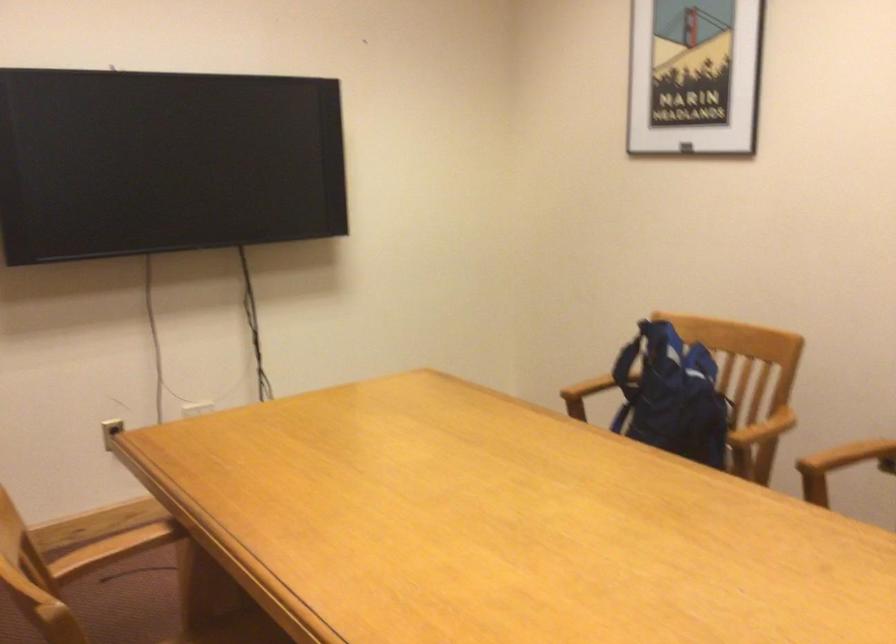
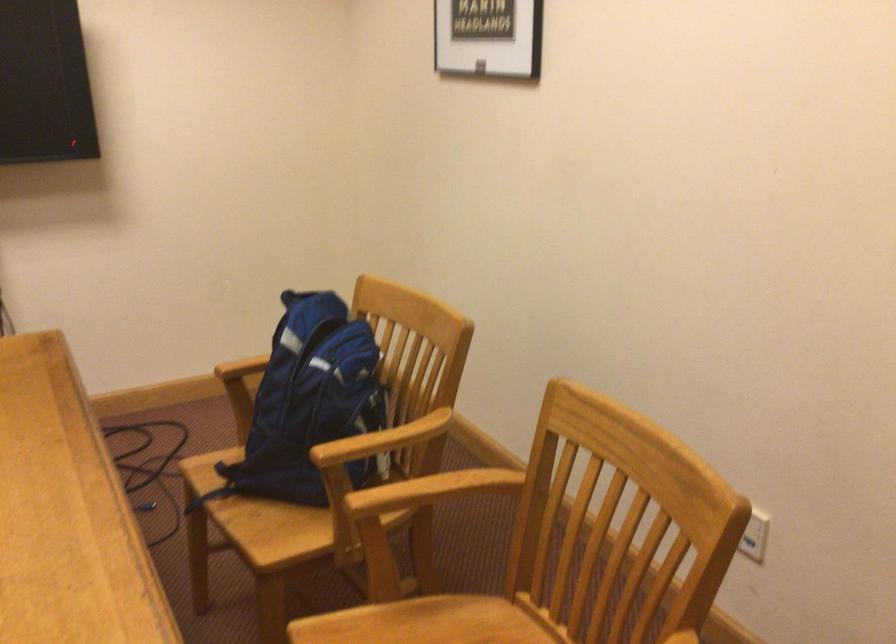
Where in the second image is the point corresponding to [751,430] from the first image?

(383, 440)